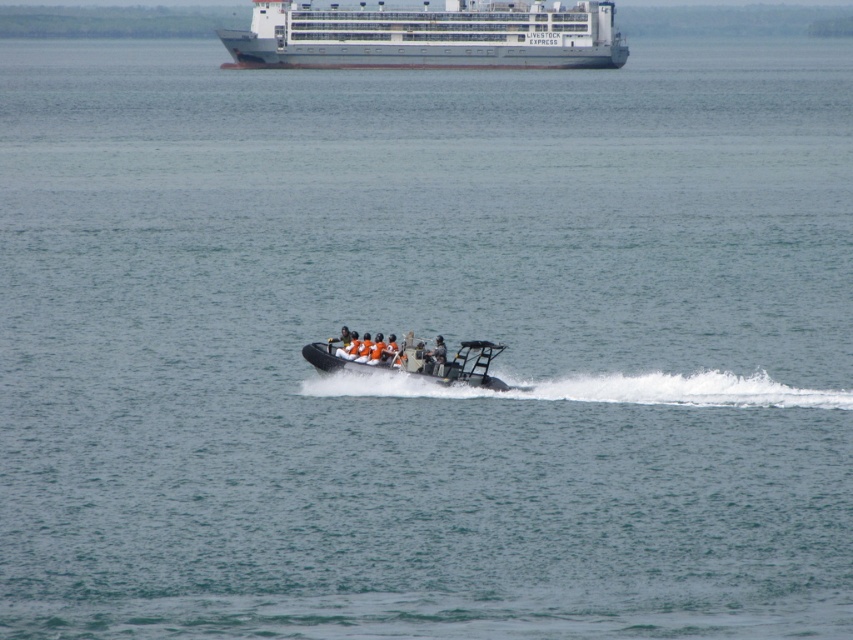
You are a photographer trying to capture a clear image of the orange fabric boat at center and the orange life vest at center. Since both are orange, you need to adjust your camera settings to focus on the one that is taller. Which object should you focus on?

The orange fabric boat at center is taller than the orange life vest at center, so you should focus on the orange fabric boat at center.

You are a passenger on the white matte cruise ship at upper center. You notice an orange fabric boat at center in the distance. From your vantage point, which boat appears closer to you?

The white matte cruise ship at upper center is closer to you because you are on it, while the orange fabric boat at center is behind it, making it farther away.

You are navigating a small motorized inflatable boat and need to dock at the white matte cruise ship at upper center. Based on the coordinates provided in the Objects Description, can you determine the direction you should head to reach the cruise ship?

The white matte cruise ship at upper center is located at point coordinates [427,36]. Since the x and y coordinates are both less than 0.5, the cruise ship is positioned in the lower left quadrant of the image. Therefore, to reach it, you should head towards the lower left direction from your current position.